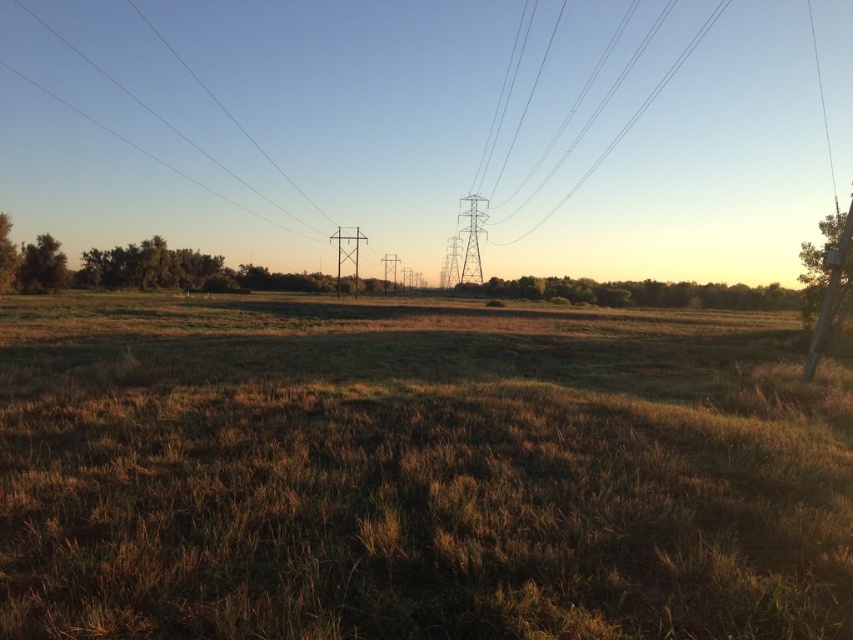
Is green leafy tree at left positioned at the back of black wire at upper center?

No, it is in front of black wire at upper center.

Which is in front, point (32, 262) or point (512, 241)?

Point (32, 262)

What do you see at coordinates (42, 266) in the screenshot?
I see `green leafy tree at left` at bounding box center [42, 266].

You are a GUI agent. You are given a task and a screenshot of the screen. Output one action in this format:
    pyautogui.click(x=<x>, y=<y>)
    Task: Click on the green leafy tree at left
    The height and width of the screenshot is (640, 853).
    Given the screenshot: What is the action you would take?
    pyautogui.click(x=42, y=266)

Which is below, green leafy tree at right or green leafy tree at left?

Positioned lower is green leafy tree at left.

Does point (804, 298) come in front of point (32, 273)?

Yes.

Is point (811, 316) closer to viewer compared to point (35, 291)?

Yes, it is in front of point (35, 291).

You are a GUI agent. You are given a task and a screenshot of the screen. Output one action in this format:
    pyautogui.click(x=<x>, y=<y>)
    Task: Click on the green leafy tree at right
    
    Given the screenshot: What is the action you would take?
    pyautogui.click(x=817, y=266)

Which is more to the left, brown dry grass at center or green leafy tree at right?

Positioned to the left is brown dry grass at center.

The width and height of the screenshot is (853, 640). What do you see at coordinates (416, 470) in the screenshot? I see `brown dry grass at center` at bounding box center [416, 470].

Does point (834, 422) come closer to viewer compared to point (839, 289)?

Yes, it is.

Find the location of a particular element. This screenshot has height=640, width=853. brown dry grass at center is located at coordinates (416, 470).